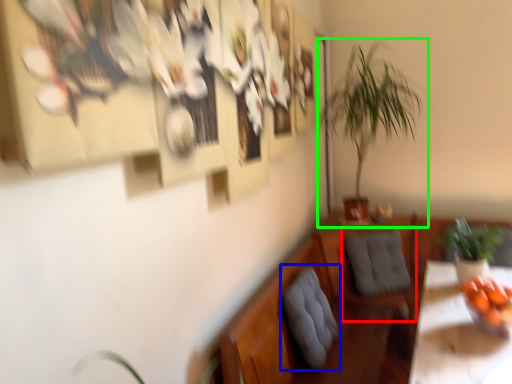
Question: Which is farther away from swivel chair (highlighted by a red box)? swivel chair (highlighted by a blue box) or houseplant (highlighted by a green box)?

Choices:
 (A) swivel chair
 (B) houseplant

Answer: (B)